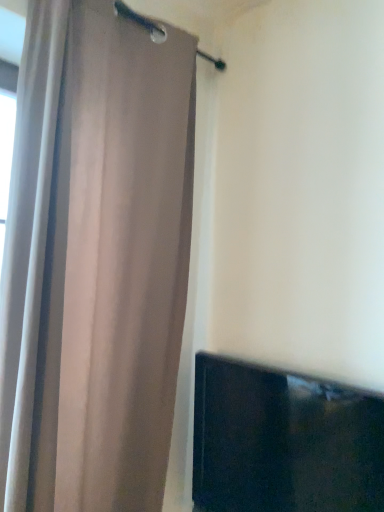
In order to face black glossy tv at lower right, should I rotate leftwards or rightwards?

You should rotate right by 10.712 degrees.

Find the location of a particular element. The height and width of the screenshot is (512, 384). black glossy tv at lower right is located at coordinates (283, 441).

Describe the element at coordinates (283, 441) in the screenshot. The height and width of the screenshot is (512, 384). I see `black glossy tv at lower right` at that location.

What are the coordinates of `black glossy tv at lower right` in the screenshot? It's located at (283, 441).